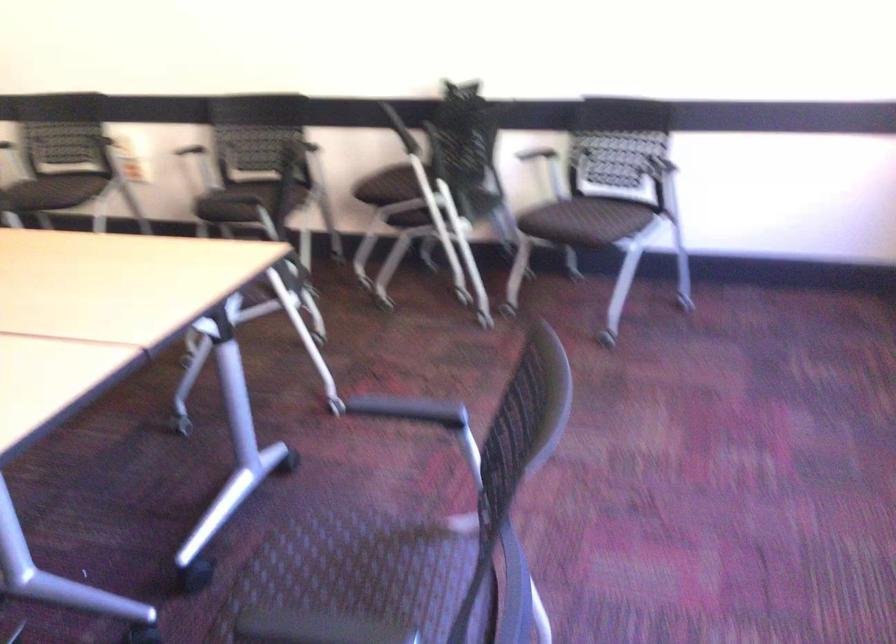
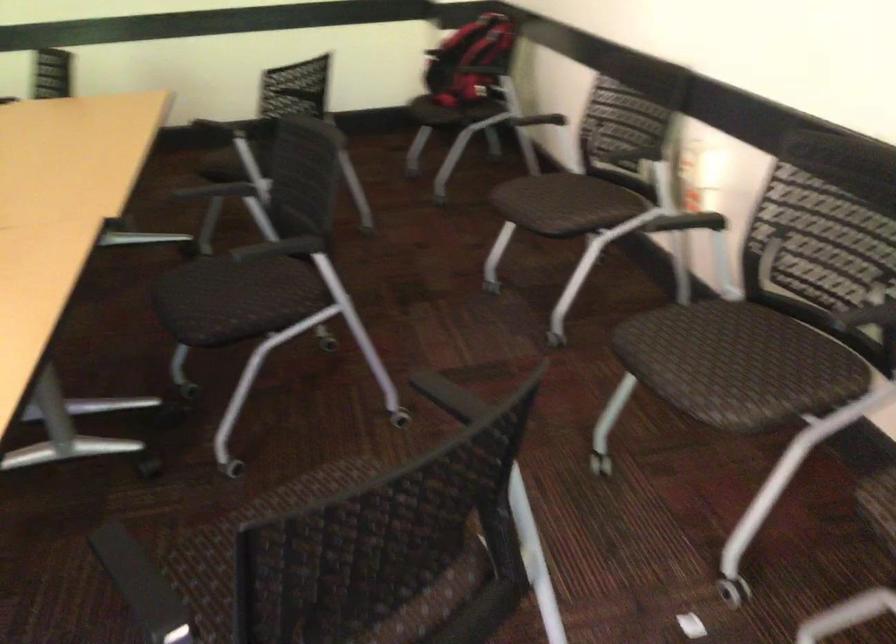
The point at [245,187] is marked in the first image. Where is the corresponding point in the second image?

(735, 335)